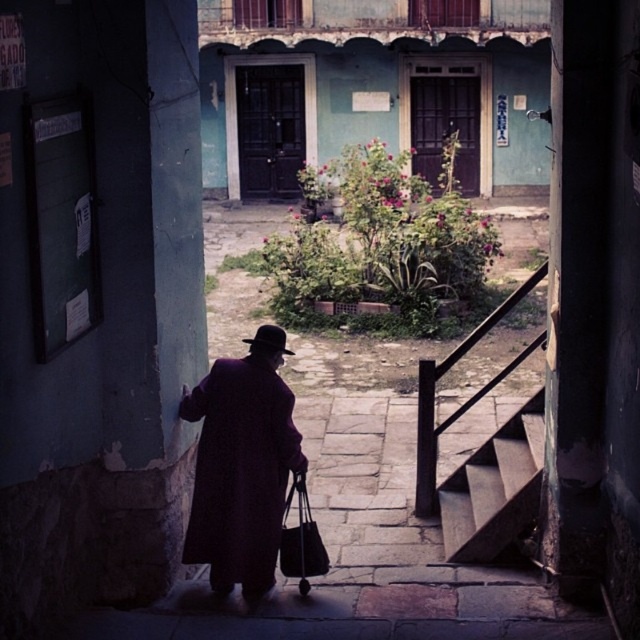
Measure the distance between purple matte coat at center and wooden stairs at center.

purple matte coat at center is 7.50 feet from wooden stairs at center.

The image size is (640, 640). I want to click on purple matte coat at center, so click(241, 468).

Can you confirm if purple matte coat at center is positioned to the right of black leather bag at center?

In fact, purple matte coat at center is to the left of black leather bag at center.

Who is more forward, (289, 387) or (321, 556)?

Point (321, 556) is more forward.

Where is `purple matte coat at center`? purple matte coat at center is located at coordinates (241, 468).

Does wooden stairs at center appear on the left side of black leather bag at center?

Incorrect, wooden stairs at center is not on the left side of black leather bag at center.

Can you confirm if wooden stairs at center is thinner than black leather bag at center?

No, wooden stairs at center is not thinner than black leather bag at center.

Is point (461, 544) farther from camera compared to point (321, 548)?

That is True.

What are the coordinates of `wooden stairs at center` in the screenshot? It's located at (493, 488).